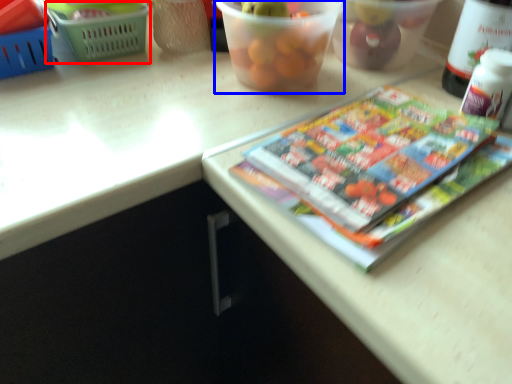
Question: Which of the following is the farthest to the observer, basket (highlighted by a red box) or glass bowl (highlighted by a blue box)?

Choices:
 (A) basket
 (B) glass bowl

Answer: (A)